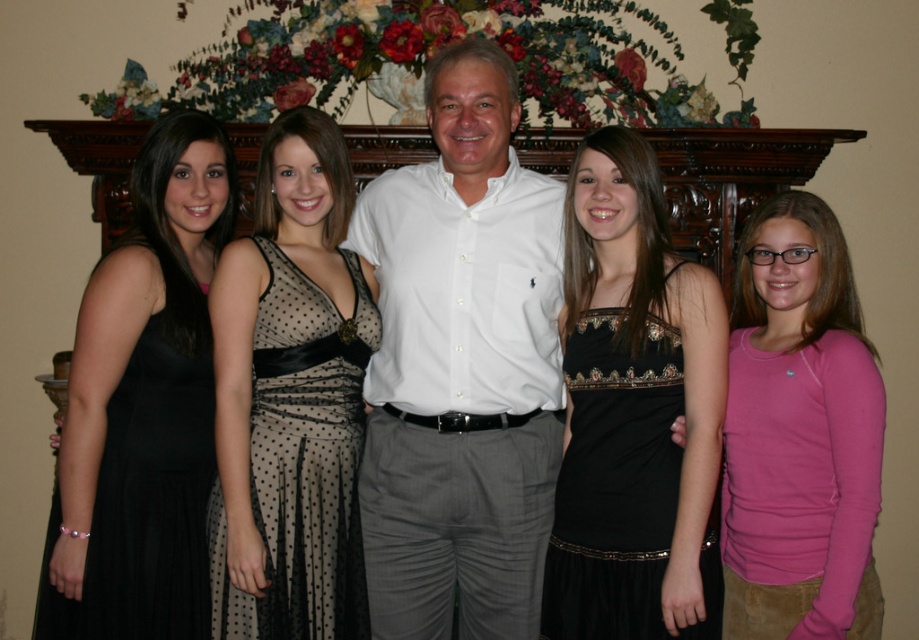
Question: Which point is farther from the camera taking this photo?

Choices:
 (A) (347, 620)
 (B) (144, 545)
 (C) (386, 518)

Answer: (C)

Question: Can you confirm if black satin dress at center is bigger than black satin dress at left?

Choices:
 (A) yes
 (B) no

Answer: (A)

Question: Is white cotton shirt at center positioned at the back of pink jersey at right?

Choices:
 (A) no
 (B) yes

Answer: (B)

Question: Does black sheer polka dot dress at center lie in front of black satin dress at center?

Choices:
 (A) yes
 (B) no

Answer: (B)

Question: Which object is farther from the camera taking this photo?

Choices:
 (A) white cotton shirt at center
 (B) black sheer polka dot dress at center
 (C) black satin dress at center
 (D) black satin dress at left

Answer: (A)

Question: Which point appears farthest from the camera in this image?

Choices:
 (A) (789, 516)
 (B) (466, 257)

Answer: (B)